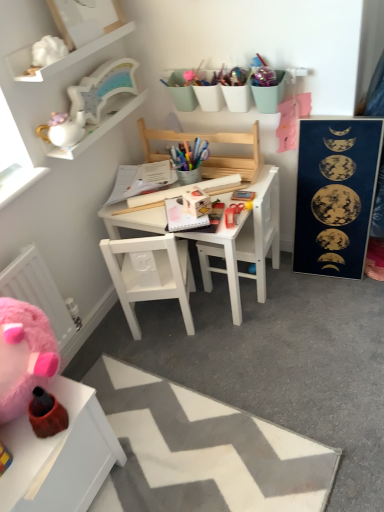
Question: Can you confirm if white ceramic teapot at upper left, which appears as the first toy when ordered from the bottom, is smaller than white zigzag rug at lower center?

Choices:
 (A) no
 (B) yes

Answer: (B)

Question: Is white zigzag rug at lower center completely or partially inside white ceramic teapot at upper left, the second toy when ordered from top to bottom?

Choices:
 (A) no
 (B) yes

Answer: (A)

Question: Is white ceramic teapot at upper left, which appears as the first toy when ordered from the bottom, positioned behind white zigzag rug at lower center?

Choices:
 (A) yes
 (B) no

Answer: (A)

Question: Can you see white ceramic teapot at upper left, the second toy when ordered from top to bottom, touching white zigzag rug at lower center?

Choices:
 (A) yes
 (B) no

Answer: (B)

Question: Is white ceramic teapot at upper left, which appears as the first toy when ordered from the bottom, closer to the viewer compared to white zigzag rug at lower center?

Choices:
 (A) no
 (B) yes

Answer: (A)

Question: Is white wooden changing table at center in front of or behind white zigzag rug at lower center in the image?

Choices:
 (A) behind
 (B) front

Answer: (A)

Question: From the image's perspective, is white wooden changing table at center above or below white zigzag rug at lower center?

Choices:
 (A) above
 (B) below

Answer: (A)

Question: Considering the relative positions of white wooden changing table at center and white zigzag rug at lower center in the image provided, is white wooden changing table at center to the left or to the right of white zigzag rug at lower center?

Choices:
 (A) right
 (B) left

Answer: (A)

Question: In terms of height, does white wooden changing table at center look taller or shorter compared to white zigzag rug at lower center?

Choices:
 (A) short
 (B) tall

Answer: (B)

Question: Do you think white glossy mug at upper left is within white wooden table at center, which is counted as the 1th table, starting from the back, or outside of it?

Choices:
 (A) inside
 (B) outside

Answer: (B)

Question: From a real-world perspective, is white glossy mug at upper left positioned above or below white wooden table at center, arranged as the second table when ordered from the bottom?

Choices:
 (A) above
 (B) below

Answer: (A)

Question: Considering the relative positions of white glossy mug at upper left and white wooden table at center, arranged as the 2th table when viewed from the front, in the image provided, is white glossy mug at upper left to the left or to the right of white wooden table at center, arranged as the 2th table when viewed from the front,?

Choices:
 (A) left
 (B) right

Answer: (A)

Question: Looking at their shapes, would you say white glossy mug at upper left is wider or thinner than white wooden table at center, arranged as the second table when ordered from the bottom?

Choices:
 (A) wide
 (B) thin

Answer: (B)

Question: Is point (236, 236) positioned closer to the camera than point (228, 173)?

Choices:
 (A) farther
 (B) closer

Answer: (B)

Question: Is white wooden changing table at center wider or thinner than wooden chair at center, which appears as the 2th chair when ordered from the bottom?

Choices:
 (A) thin
 (B) wide

Answer: (B)